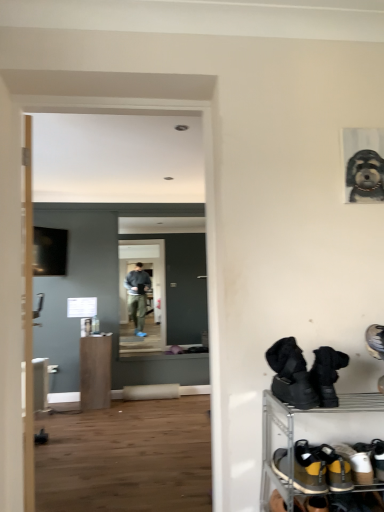
The width and height of the screenshot is (384, 512). I want to click on black rubber boots at lower right, so pos(293,435).

What do you see at coordinates (365, 177) in the screenshot? The width and height of the screenshot is (384, 512). I see `gray textured dog portrait at upper right` at bounding box center [365, 177].

This screenshot has height=512, width=384. I want to click on transparent glass door at center, so click(x=183, y=285).

Find the location of a particular element. The height and width of the screenshot is (512, 384). black rubber boots at lower right is located at coordinates (293, 435).

Is matte brown cabinet at center shorter than transparent glass door at center?

Indeed, matte brown cabinet at center has a lesser height compared to transparent glass door at center.

Is matte brown cabinet at center bigger or smaller than transparent glass door at center?

Clearly, matte brown cabinet at center is larger in size than transparent glass door at center.

Which of these two, yellow suede sneakers at lower right, the first footwear in the bottom-to-top sequence, or brown suede shoes at lower right, the second footwear viewed from the top, stands taller?

Standing taller between the two is brown suede shoes at lower right, the second footwear viewed from the top.

From a real-world perspective, which object rests below the other?

In real-world perspective, yellow suede sneakers at lower right, the first footwear in the bottom-to-top sequence, is lower.

Does yellow suede sneakers at lower right, the first footwear in the bottom-to-top sequence, have a greater width compared to brown suede shoes at lower right, the second footwear viewed from the top?

No, yellow suede sneakers at lower right, the first footwear in the bottom-to-top sequence, is not wider than brown suede shoes at lower right, the second footwear viewed from the top.

Measure the distance from yellow suede sneakers at lower right, the first footwear in the bottom-to-top sequence, to brown suede shoes at lower right, the second footwear viewed from the top.

They are 2.19 inches apart.

Is black suede boots at lower right, arranged as the first footwear when viewed from the top, not near yellow suede sneakers at lower right, which is the third footwear from top to bottom?

That's not correct — black suede boots at lower right, arranged as the first footwear when viewed from the top, is a little close to yellow suede sneakers at lower right, which is the third footwear from top to bottom.

Is black suede boots at lower right, arranged as the first footwear when viewed from the top, aimed at yellow suede sneakers at lower right, the first footwear in the bottom-to-top sequence?

No.

Between black suede boots at lower right, arranged as the first footwear when viewed from the top, and yellow suede sneakers at lower right, which is the third footwear from top to bottom, which one appears on the right side from the viewer's perspective?

black suede boots at lower right, arranged as the first footwear when viewed from the top, is more to the right.

From a real-world perspective, which is physically above, black suede boots at lower right, arranged as the first footwear when viewed from the top, or yellow suede sneakers at lower right, which is the third footwear from top to bottom?

From a 3D spatial view, black suede boots at lower right, arranged as the first footwear when viewed from the top, is above.

Is gray textured dog portrait at upper right touching yellow suede sneakers at lower right, which is the third footwear from top to bottom?

No, gray textured dog portrait at upper right is not next to yellow suede sneakers at lower right, which is the third footwear from top to bottom.

Considering the positions of objects gray textured dog portrait at upper right and yellow suede sneakers at lower right, the first footwear in the bottom-to-top sequence, in the image provided, who is more to the right, gray textured dog portrait at upper right or yellow suede sneakers at lower right, the first footwear in the bottom-to-top sequence,?

From the viewer's perspective, gray textured dog portrait at upper right appears more on the right side.

In terms of width, does gray textured dog portrait at upper right look wider or thinner when compared to yellow suede sneakers at lower right, which is the third footwear from top to bottom?

gray textured dog portrait at upper right is thinner than yellow suede sneakers at lower right, which is the third footwear from top to bottom.

What's the angular difference between gray textured dog portrait at upper right and yellow suede sneakers at lower right, which is the third footwear from top to bottom,'s facing directions?

The angular difference between gray textured dog portrait at upper right and yellow suede sneakers at lower right, which is the third footwear from top to bottom, is 0.461 degrees.

Considering the sizes of objects black rubber boots at lower right and transparent glass door at center in the image provided, who is smaller, black rubber boots at lower right or transparent glass door at center?

transparent glass door at center is smaller.

Which object is wider, black rubber boots at lower right or transparent glass door at center?

black rubber boots at lower right.

Is transparent glass door at center surrounded by black rubber boots at lower right?

No, transparent glass door at center is located outside of black rubber boots at lower right.

Which is behind, black rubber boots at lower right or transparent glass door at center?

transparent glass door at center is further away from the camera.

From a real-world perspective, which is physically above, transparent glass door at center or yellow suede sneakers at lower right, the first footwear in the bottom-to-top sequence?

transparent glass door at center, from a real-world perspective.

Is transparent glass door at center with yellow suede sneakers at lower right, which is the third footwear from top to bottom?

They are not placed beside each other.

In terms of height, does transparent glass door at center look taller or shorter compared to yellow suede sneakers at lower right, which is the third footwear from top to bottom?

Clearly, transparent glass door at center is taller compared to yellow suede sneakers at lower right, which is the third footwear from top to bottom.

From the image's perspective, does transparent glass door at center appear higher than yellow suede sneakers at lower right, the first footwear in the bottom-to-top sequence?

Yes, from the image's perspective, transparent glass door at center is above yellow suede sneakers at lower right, the first footwear in the bottom-to-top sequence.

Would you say transparent glass door at center is inside or outside gray textured dog portrait at upper right?

transparent glass door at center is not enclosed by gray textured dog portrait at upper right.

Considering the relative sizes of transparent glass door at center and gray textured dog portrait at upper right in the image provided, is transparent glass door at center shorter than gray textured dog portrait at upper right?

No.

Considering the relative sizes of transparent glass door at center and gray textured dog portrait at upper right in the image provided, is transparent glass door at center smaller than gray textured dog portrait at upper right?

No, transparent glass door at center is not smaller than gray textured dog portrait at upper right.

Locate an element on the screen. furniture that is in front of the transparent glass door at center is located at coordinates (95, 371).

In order to click on footwear on the left of brown suede shoes at lower right, which ranks as the second footwear in bottom-to-top order in this screenshot , I will do `click(309, 469)`.

From the image, which object appears to be farther from yellow suede sneakers at lower right, the first footwear in the bottom-to-top sequence, brown suede shoes at lower right, the second footwear viewed from the top, or gray textured dog portrait at upper right?

The object further to yellow suede sneakers at lower right, the first footwear in the bottom-to-top sequence, is gray textured dog portrait at upper right.

Considering their positions, is matte brown cabinet at center positioned further to yellow suede sneakers at lower right, which is the third footwear from top to bottom, than black rubber boots at lower right?

The object further to yellow suede sneakers at lower right, which is the third footwear from top to bottom, is matte brown cabinet at center.

From the image, which object appears to be nearer to black suede boots at lower right, arranged as the first footwear when viewed from the top, yellow suede sneakers at lower right, which is the third footwear from top to bottom, or transparent glass door at center?

yellow suede sneakers at lower right, which is the third footwear from top to bottom, is closer to black suede boots at lower right, arranged as the first footwear when viewed from the top.

Considering their positions, is brown suede shoes at lower right, which ranks as the second footwear in bottom-to-top order, positioned further to matte brown cabinet at center than black suede boots at lower right, which is the third footwear from bottom to top?

Based on the image, brown suede shoes at lower right, which ranks as the second footwear in bottom-to-top order, appears to be further to matte brown cabinet at center.

Looking at the image, which one is located closer to matte brown cabinet at center, yellow suede sneakers at lower right, the first footwear in the bottom-to-top sequence, or brown suede shoes at lower right, which ranks as the second footwear in bottom-to-top order?

yellow suede sneakers at lower right, the first footwear in the bottom-to-top sequence, is positioned closer to the anchor matte brown cabinet at center.

In the scene shown: Considering their positions, is transparent glass door at center positioned closer to matte brown cabinet at center than black suede boots at lower right, which is the third footwear from bottom to top?

Based on the image, transparent glass door at center appears to be nearer to matte brown cabinet at center.

When comparing their distances from gray textured dog portrait at upper right, does matte brown cabinet at center or brown suede shoes at lower right, the second footwear viewed from the top, seem closer?

The object closer to gray textured dog portrait at upper right is brown suede shoes at lower right, the second footwear viewed from the top.

When comparing their distances from brown suede shoes at lower right, which ranks as the second footwear in bottom-to-top order, does gray textured dog portrait at upper right or transparent glass door at center seem closer?

gray textured dog portrait at upper right lies closer to brown suede shoes at lower right, which ranks as the second footwear in bottom-to-top order, than the other object.

You are a GUI agent. You are given a task and a screenshot of the screen. Output one action in this format:
    pyautogui.click(x=<x>, y=<y>)
    Task: Click on the footwear between gray textured dog portrait at upper right and brown suede shoes at lower right, the second footwear viewed from the top, in the vertical direction
    Image resolution: width=384 pixels, height=512 pixels.
    Given the screenshot: What is the action you would take?
    pyautogui.click(x=305, y=375)

Identify the location of furniture between brown suede shoes at lower right, the second footwear viewed from the top, and transparent glass door at center from front to back. The height and width of the screenshot is (512, 384). (95, 371).

The width and height of the screenshot is (384, 512). I want to click on dog positioned between yellow suede sneakers at lower right, which is the third footwear from top to bottom, and matte brown cabinet at center from near to far, so click(365, 177).

This screenshot has height=512, width=384. I want to click on dog located between black rubber boots at lower right and matte brown cabinet at center in the depth direction, so click(365, 177).